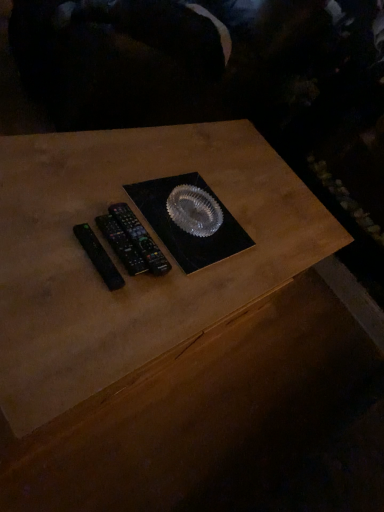
Find the location of a particular element. vacant area located to the right-hand side of black plastic remote at left, placed as the third control when sorted from back to front is located at coordinates (156, 307).